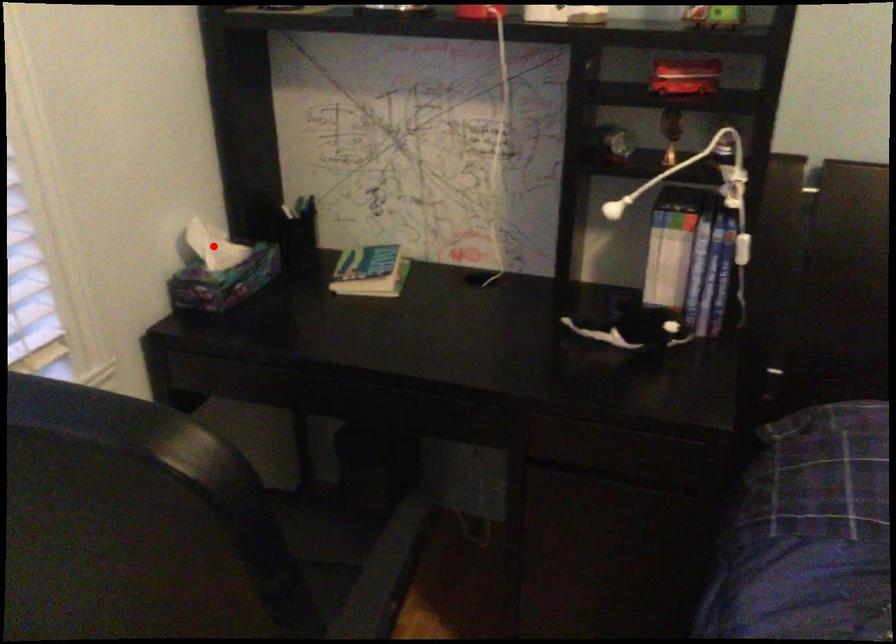
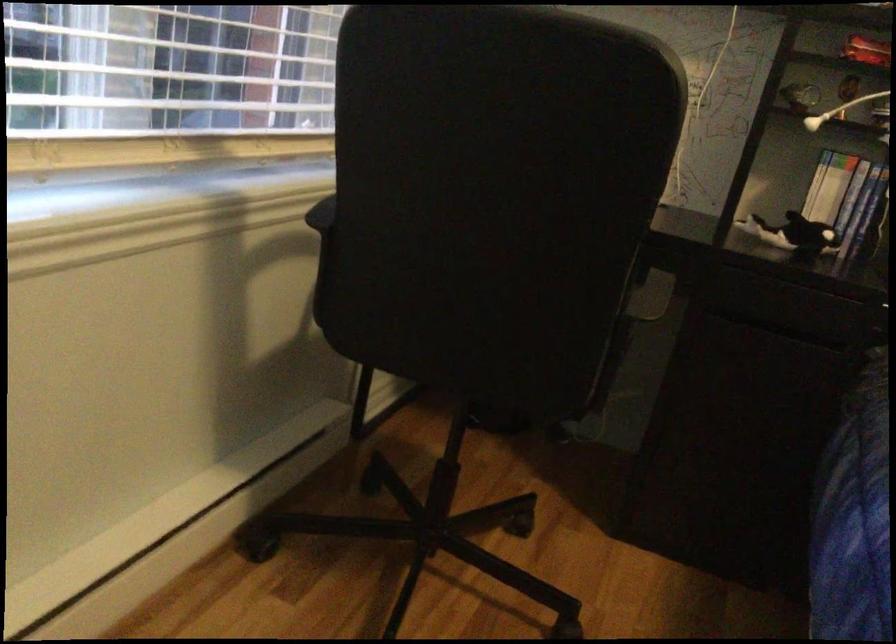
Question: I am providing you with two images of the same scene from different viewpoints. A red point is marked on the first image. Can you still see the location of the red point in image 2?

Choices:
 (A) Yes
 (B) No

Answer: (B)